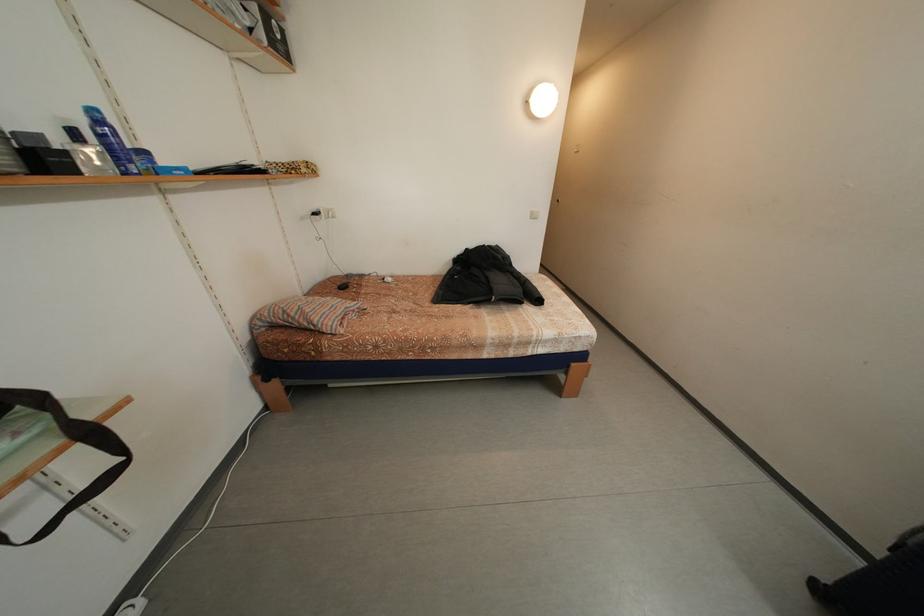
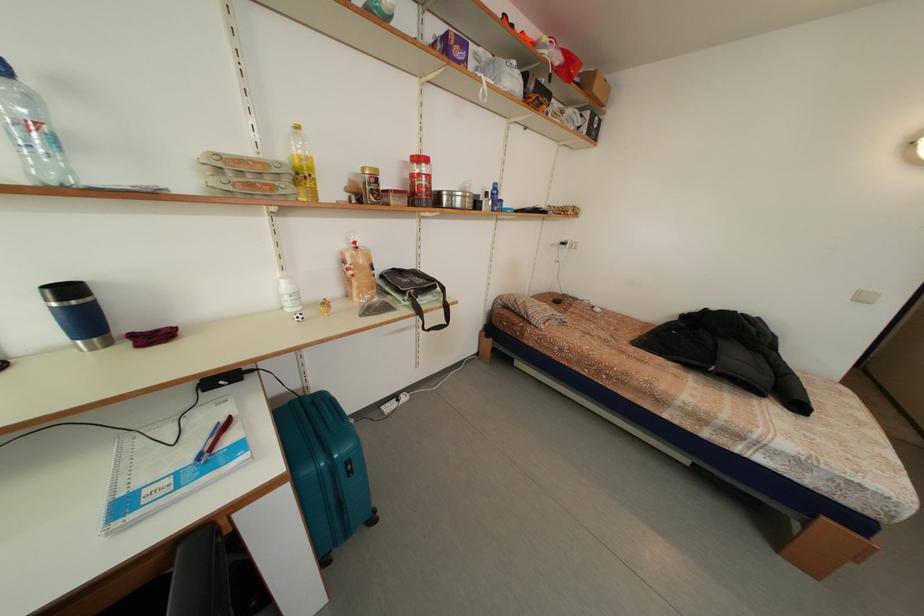
Where in the second image is the point corresponding to pixel 67 447 from the first image?

(448, 310)